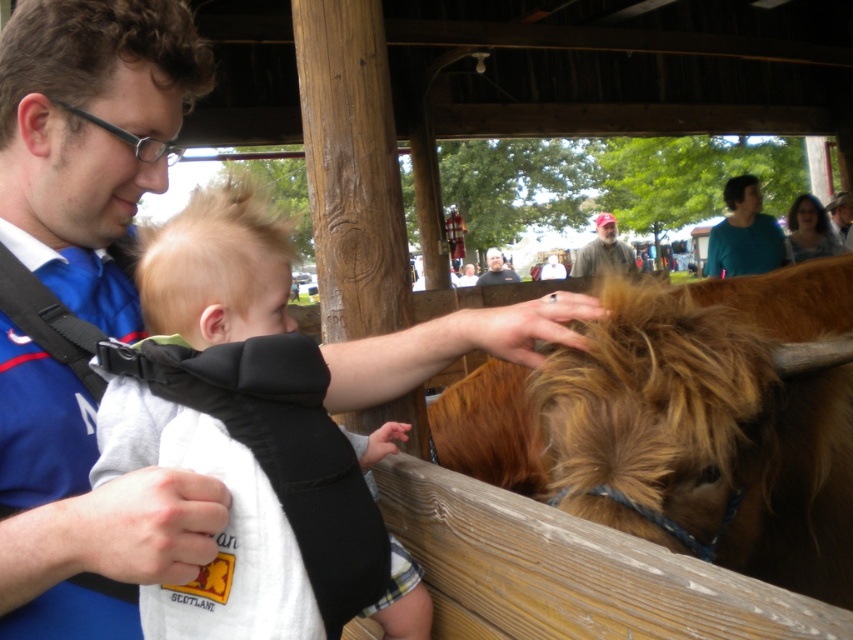
Can you confirm if beige fabric cap at upper center is taller than brown leather hat at upper right?

In fact, beige fabric cap at upper center may be shorter than brown leather hat at upper right.

Can you confirm if beige fabric cap at upper center is smaller than brown leather hat at upper right?

Indeed, beige fabric cap at upper center has a smaller size compared to brown leather hat at upper right.

Describe the element at coordinates (602, 252) in the screenshot. The width and height of the screenshot is (853, 640). I see `beige fabric cap at upper center` at that location.

Find the location of a particular element. beige fabric cap at upper center is located at coordinates (602, 252).

Is point (154, 436) positioned behind point (838, 224)?

That is False.

Find the location of a particular element. The width and height of the screenshot is (853, 640). light gray fabric baby carrier at center is located at coordinates click(219, 532).

Is point (740, 300) less distant than point (497, 260)?

Yes, point (740, 300) is in front of point (497, 260).

Where is `brown fuzzy bull at center`? brown fuzzy bull at center is located at coordinates [685, 424].